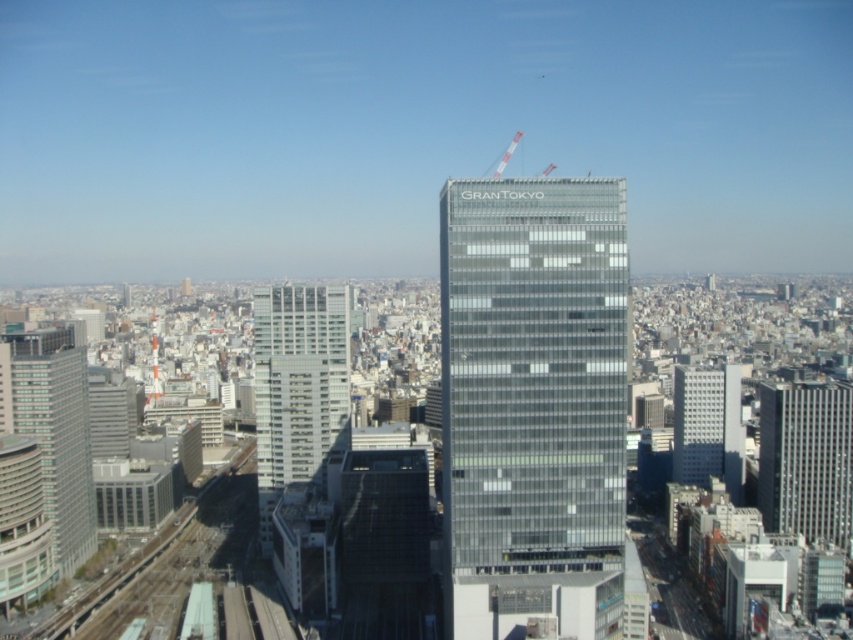
Question: Estimate the real-world distances between objects in this image. Which object is closer to the white metallic crane at upper center?

Choices:
 (A) metallic red crane at upper center
 (B) glassy reflective building at center
 (C) gray concrete building at right

Answer: (A)

Question: Estimate the real-world distances between objects in this image. Which object is farther from the white metallic crane at upper center?

Choices:
 (A) glassy reflective building at center
 (B) silver glass skyscraper at left

Answer: (B)

Question: Can you confirm if silver metallic building at right is smaller than gray concrete building at right?

Choices:
 (A) no
 (B) yes

Answer: (A)

Question: Is glassy reflective building at center positioned before gray concrete building at right?

Choices:
 (A) yes
 (B) no

Answer: (A)

Question: Which object is positioned closest to the silver metallic building at right?

Choices:
 (A) transparent glass building at center
 (B) white metallic crane at upper center
 (C) silver glass skyscraper at left
 (D) gray concrete building at right

Answer: (D)

Question: Is silver metallic building at right behind gray concrete building at right?

Choices:
 (A) yes
 (B) no

Answer: (B)